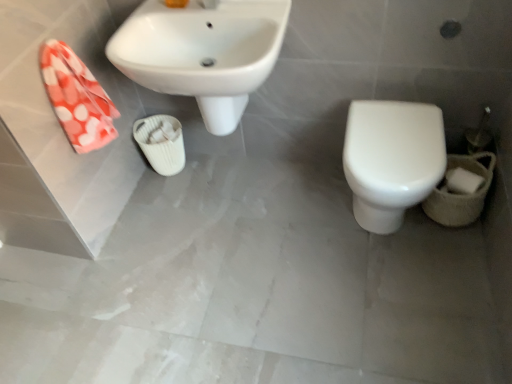
Identify the location of vacant area located to the right-hand side of white ribbed cup at center. (210, 168).